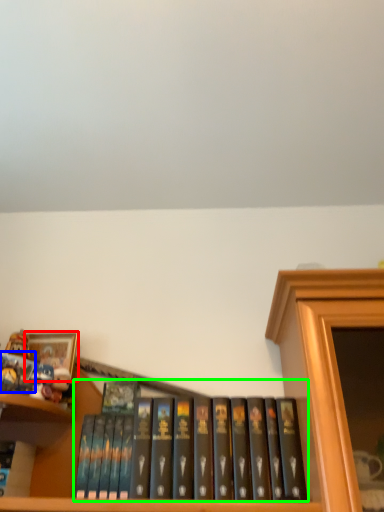
Question: Based on their relative distances, which object is farther from picture frame (highlighted by a red box)? Choose from book (highlighted by a blue box) and book (highlighted by a green box).

Choices:
 (A) book
 (B) book

Answer: (B)